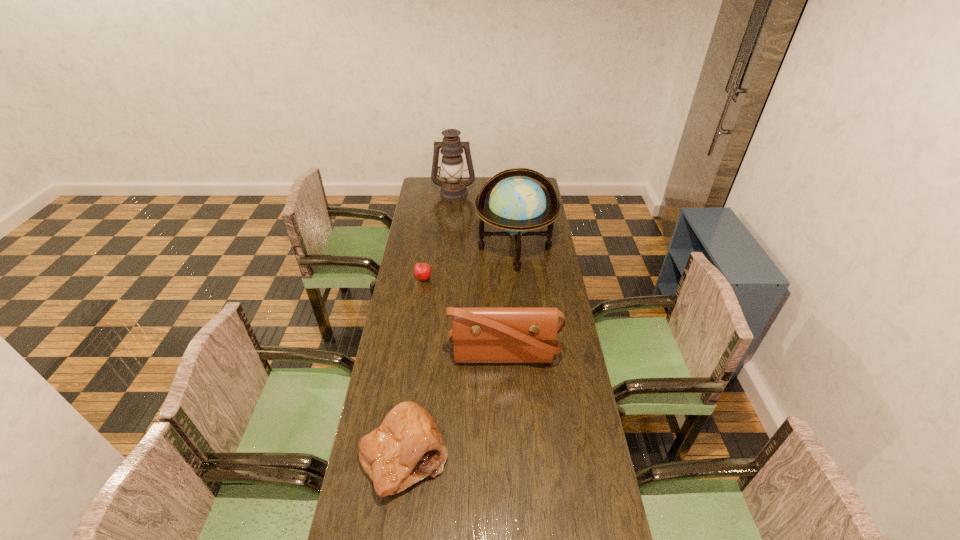
What are the coordinates of `vacant point located on the filling side of the nearest object` in the screenshot? It's located at pos(395,531).

The image size is (960, 540). I want to click on vacant region located on the front of the shortest object, so [x=416, y=332].

The width and height of the screenshot is (960, 540). What are the coordinates of `object that is at the far edge` in the screenshot? It's located at (452, 189).

The height and width of the screenshot is (540, 960). In order to click on oil lamp present at the left edge in this screenshot , I will do `click(452, 189)`.

You are a GUI agent. You are given a task and a screenshot of the screen. Output one action in this format:
    pyautogui.click(x=<x>, y=<y>)
    Task: Click on the bread at the left edge
    
    Given the screenshot: What is the action you would take?
    pyautogui.click(x=407, y=447)

At what (x,y) coordinates should I click in order to perform the action: click on apple situated at the left edge. Please return your answer as a coordinate pair (x, y). Looking at the image, I should click on (422, 271).

Where is `globe located at the right edge`? Image resolution: width=960 pixels, height=540 pixels. globe located at the right edge is located at coordinates (517, 204).

At what (x,y) coordinates should I click in order to perform the action: click on satchel located in the right edge section of the desktop. Please return your answer as a coordinate pair (x, y). This screenshot has width=960, height=540. Looking at the image, I should click on (479, 334).

You are a GUI agent. You are given a task and a screenshot of the screen. Output one action in this format:
    pyautogui.click(x=<x>, y=<y>)
    Task: Click on the object that is at the far left corner
    The width and height of the screenshot is (960, 540).
    Given the screenshot: What is the action you would take?
    pyautogui.click(x=452, y=189)

Identify the location of free space at the left edge of the desktop. (392, 324).